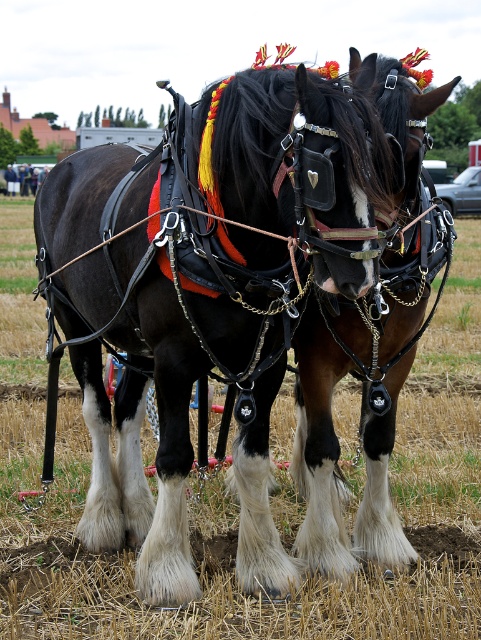
Looking at this image, you are a farmer who needs to attach a new harness to the black leather horse at center and the brushed metal water at bottle left. Which one requires a harness that can accommodate a taller object?

The black leather horse at center requires a harness that can accommodate a taller object because it is much taller than the brushed metal water at bottle left.

You are a farmer who needs to water your horses. You see a black leather horse at center and a brushed metal water at bottle left. Which horse is closer to the water bottle?

The black leather horse at center is positioned on the right side of brushed metal water at bottle left, meaning the horse on the left is closer to the water bottle.

You are a farmer who needs to water your horses. There is a black leather horse at center and a brushed metal water at bottle left. How far apart are these two items?

The black leather horse at center and the brushed metal water at bottle left are 100.49 feet apart.